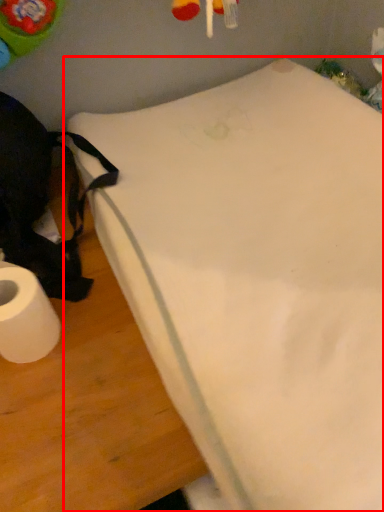
Question: Observing the image, what is the correct spatial positioning of furniture (annotated by the red box) in reference to toilet paper?

Choices:
 (A) right
 (B) left

Answer: (A)